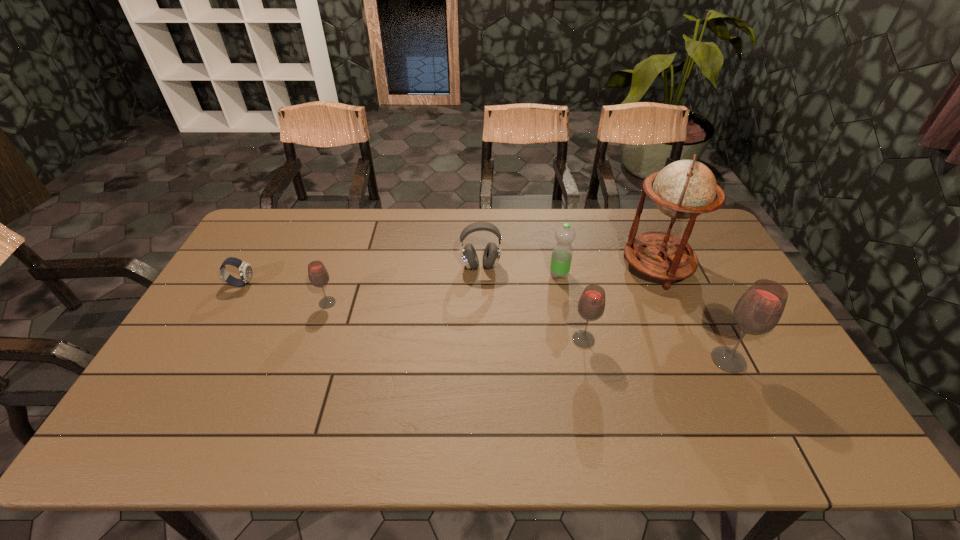
The height and width of the screenshot is (540, 960). Find the location of `object that is at the left edge`. object that is at the left edge is located at coordinates (245, 270).

Where is `glass drink container at the right edge`? glass drink container at the right edge is located at coordinates (758, 311).

Find the location of a particular element. This screenshot has width=960, height=540. globe that is at the right edge is located at coordinates (684, 189).

The width and height of the screenshot is (960, 540). What are the coordinates of `object at the far right corner` in the screenshot? It's located at (684, 189).

This screenshot has width=960, height=540. Identify the location of free region at the far edge of the desktop. (396, 220).

In the image, there is a desktop. Identify the location of free space at the near edge. (294, 388).

This screenshot has width=960, height=540. Find the location of `blank area at the left edge`. blank area at the left edge is located at coordinates (222, 283).

Locate an element on the screen. The height and width of the screenshot is (540, 960). vacant space at the right edge of the desktop is located at coordinates (709, 260).

In the image, there is a desktop. Where is `vacant space at the far left corner`? vacant space at the far left corner is located at coordinates (288, 222).

Where is `free space between the farthest glass drink container and the water bottle`? The image size is (960, 540). free space between the farthest glass drink container and the water bottle is located at coordinates (444, 288).